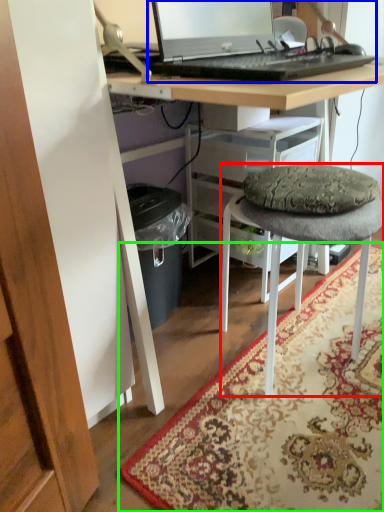
Question: Considering the real-world distances, which object is farthest from stool (highlighted by a red box)? computer (highlighted by a blue box) or mat (highlighted by a green box)?

Choices:
 (A) computer
 (B) mat

Answer: (A)